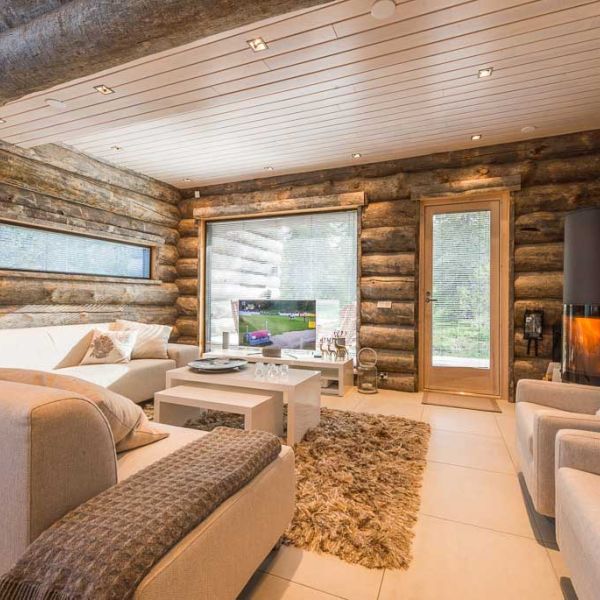
Locate an element on the screen. This screenshot has width=600, height=600. 2 piece table set is located at coordinates (298, 396), (237, 412).